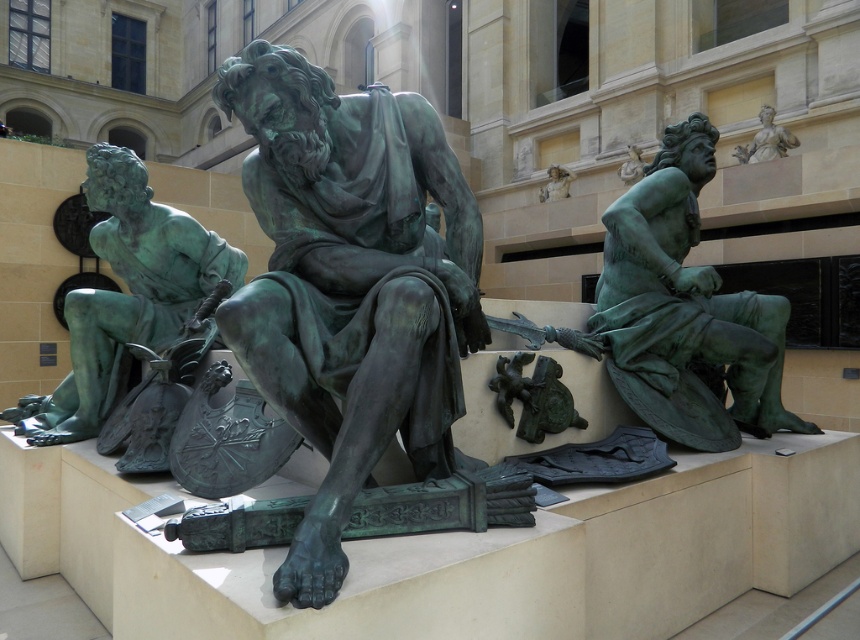
You are standing in the museum and want to take a photo of the sculpture located at point (182, 301). If your camera has a maximum focus range of 15 feet, will you be able to capture a clear image of the sculpture at that point from your current position?

The distance between you and the sculpture at point (182, 301) is 15.80 feet, which exceeds your camera maximum focus range of 15 feet. Therefore, you won not be able to capture a clear image.

You are a museum security guard who needs to place a 1.5 meter wide barrier between the green patina statue at center and the green patina statue at right. Is there enough space to place it without moving the statues?

The distance between the green patina statue at center and the green patina statue at right is 1.61 meters. Since the barrier is 1.5 meters wide, there is enough space to place it between them without moving the statues.

You are an art curator arranging a new exhibition. You need to place a new sculpture between the green patina statue at left and the green patina statue at upper center. Based on their current positions, where should you position the new sculpture to maintain the existing spatial relationship?

The new sculpture should be placed between the green patina statue at left and the green patina statue at upper center, ensuring it is to the right of the green patina statue at left and to the left of the green patina statue at upper center, maintaining their left to right order.